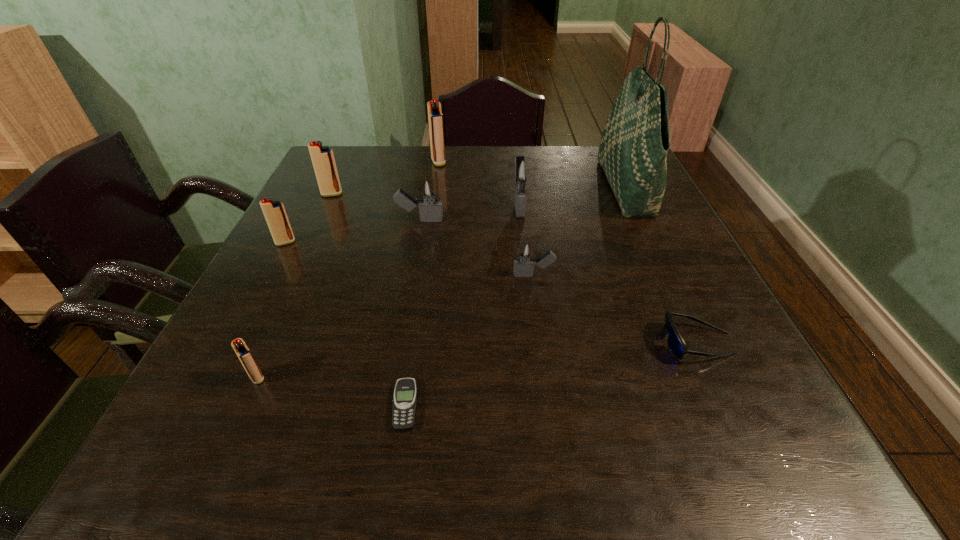
This screenshot has width=960, height=540. What are the coordinates of `vacant space located 0.400m on the left of the biggest gray igniter` in the screenshot? It's located at (350, 204).

At what (x,y) coordinates should I click in order to perform the action: click on free space located on the back of the second smallest gray igniter. Please return your answer as a coordinate pair (x, y). This screenshot has height=540, width=960. Looking at the image, I should click on (431, 153).

The width and height of the screenshot is (960, 540). In order to click on free spot located 0.230m on the right of the leftmost igniter in this screenshot , I will do `click(394, 242)`.

At what (x,y) coordinates should I click in order to perform the action: click on vacant region located on the back of the nearest red igniter. Please return your answer as a coordinate pair (x, y). The image size is (960, 540). Looking at the image, I should click on (286, 312).

Locate an element on the screen. The width and height of the screenshot is (960, 540). vacant space located on the left of the seventh farthest object is located at coordinates (429, 275).

This screenshot has width=960, height=540. What are the coordinates of `free spot located 0.140m on the front-facing side of the eighth farthest object` in the screenshot? It's located at (586, 343).

The height and width of the screenshot is (540, 960). I want to click on free space located 0.330m on the front-facing side of the eighth farthest object, so click(481, 343).

I want to click on free spot located on the front-facing side of the eighth farthest object, so click(558, 343).

This screenshot has width=960, height=540. What are the coordinates of `vacant space situated 0.200m on the left of the shortest object` in the screenshot? It's located at (269, 406).

Where is `tote bag that is positioned at the far edge`? The height and width of the screenshot is (540, 960). tote bag that is positioned at the far edge is located at coordinates (634, 144).